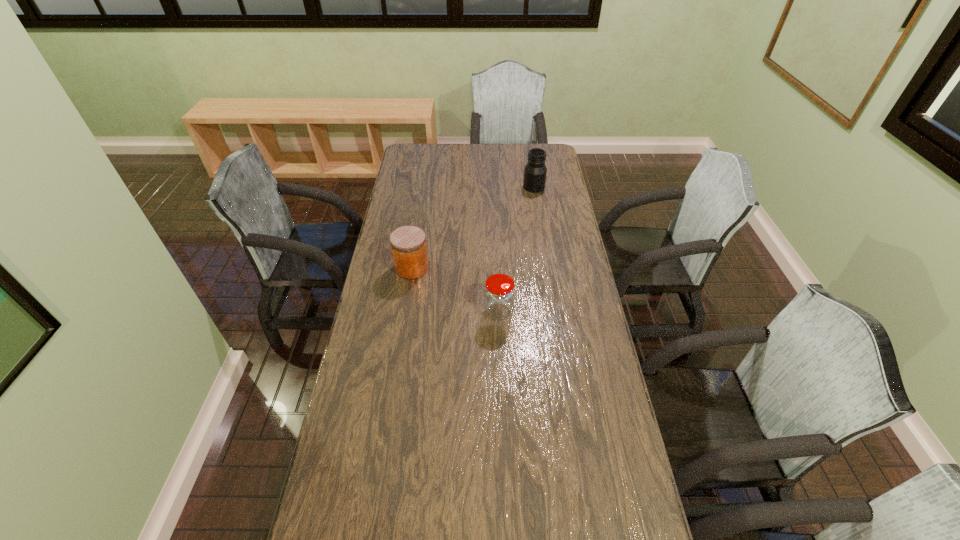
Where is `the farthest jar`? the farthest jar is located at coordinates (535, 171).

This screenshot has width=960, height=540. Find the location of `the rightmost object`. the rightmost object is located at coordinates (535, 171).

Find the location of a particular element. The image size is (960, 540). the leftmost object is located at coordinates (408, 243).

Locate an element on the screen. This screenshot has height=540, width=960. the second farthest jar is located at coordinates (408, 243).

Identify the location of the second object from left to right. The height and width of the screenshot is (540, 960). (499, 293).

Locate an element on the screen. the second jar from right to left is located at coordinates (499, 293).

At what (x,y) coordinates should I click in order to perform the action: click on vacant point located 0.400m on the left of the farthest object. Please return your answer as a coordinate pair (x, y). Looking at the image, I should click on (437, 187).

Image resolution: width=960 pixels, height=540 pixels. What are the coordinates of `vacant space situated 0.090m on the back of the second nearest jar` in the screenshot? It's located at (416, 241).

Image resolution: width=960 pixels, height=540 pixels. In order to click on vacant space located on the right of the second jar from right to left in this screenshot , I will do `click(587, 313)`.

Find the location of a particular element. object present at the left edge is located at coordinates (408, 243).